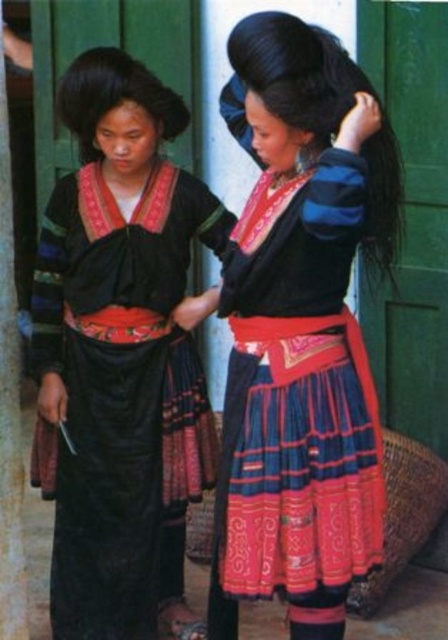
Does point (156, 200) lie behind point (5, 508)?

That is True.

Who is more forward, (99, 436) or (4, 625)?

Positioned in front is point (4, 625).

The image size is (448, 640). In order to click on matte black skirt at left in this screenshot , I will do `click(117, 342)`.

Is point (324, 436) closer to viewer compared to point (4, 506)?

Yes, point (324, 436) is closer to viewer.

This screenshot has width=448, height=640. What do you see at coordinates (301, 333) in the screenshot? I see `matte black blouse at upper center` at bounding box center [301, 333].

Image resolution: width=448 pixels, height=640 pixels. I want to click on matte black blouse at upper center, so click(x=301, y=333).

Looking at this image, which is above, matte black blouse at upper center or matte black skirt at left?

matte black blouse at upper center

Does matte black blouse at upper center appear on the right side of matte black skirt at left?

Correct, you'll find matte black blouse at upper center to the right of matte black skirt at left.

Is point (291, 250) farther from camera compared to point (95, 65)?

No, it is in front of (95, 65).

At what (x,y) coordinates should I click in order to perform the action: click on matte black blouse at upper center. Please return your answer as a coordinate pair (x, y). The height and width of the screenshot is (640, 448). Looking at the image, I should click on (301, 333).